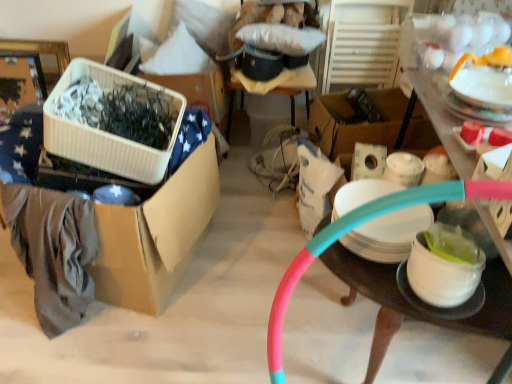
Find the location of a particular element. vacant area that lies to the right of cardboard box at left, arranged as the first storage box when viewed from the left is located at coordinates (250, 262).